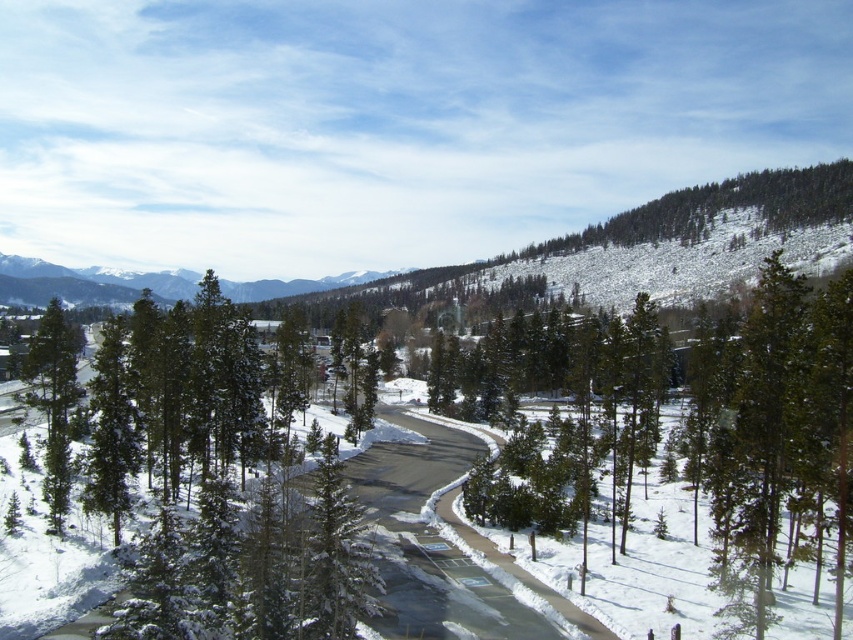
Question: Is green textured pine at center further to the viewer compared to green matte tree at left?

Choices:
 (A) no
 (B) yes

Answer: (A)

Question: Which point appears farthest from the camera in this image?

Choices:
 (A) (45, 410)
 (B) (851, 486)

Answer: (A)

Question: Can you confirm if green textured pine at center is positioned below green matte tree at left?

Choices:
 (A) yes
 (B) no

Answer: (B)

Question: Which of the following is the closest to the observer?

Choices:
 (A) green matte tree at left
 (B) green textured pine at center

Answer: (B)

Question: Which of the following is the closest to the observer?

Choices:
 (A) (33, 364)
 (B) (766, 449)

Answer: (B)

Question: Does green textured pine at center appear under green matte tree at left?

Choices:
 (A) yes
 (B) no

Answer: (B)